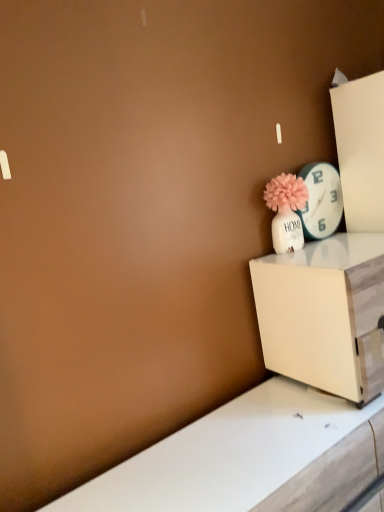
Question: Is white glossy clock at upper right to the left of matte white vase with pink flower at upper right from the viewer's perspective?

Choices:
 (A) yes
 (B) no

Answer: (B)

Question: Does white glossy clock at upper right have a greater width compared to matte white vase with pink flower at upper right?

Choices:
 (A) no
 (B) yes

Answer: (A)

Question: Considering the relative sizes of white glossy clock at upper right and matte white vase with pink flower at upper right in the image provided, is white glossy clock at upper right smaller than matte white vase with pink flower at upper right?

Choices:
 (A) yes
 (B) no

Answer: (A)

Question: Does white glossy clock at upper right have a lesser width compared to matte white vase with pink flower at upper right?

Choices:
 (A) yes
 (B) no

Answer: (A)

Question: From the image's perspective, is white glossy clock at upper right located beneath matte white vase with pink flower at upper right?

Choices:
 (A) no
 (B) yes

Answer: (A)

Question: Considering their positions, is white glossy clock at upper right located in front of or behind matte white vase with pink flower at upper right?

Choices:
 (A) behind
 (B) front

Answer: (A)

Question: In terms of width, does white glossy clock at upper right look wider or thinner when compared to matte white vase with pink flower at upper right?

Choices:
 (A) thin
 (B) wide

Answer: (A)

Question: Considering the positions of white glossy clock at upper right and matte white vase with pink flower at upper right in the image, is white glossy clock at upper right taller or shorter than matte white vase with pink flower at upper right?

Choices:
 (A) tall
 (B) short

Answer: (A)

Question: From a real-world perspective, is white glossy clock at upper right above or below matte white vase with pink flower at upper right?

Choices:
 (A) below
 (B) above

Answer: (B)

Question: Choose the correct answer: Is matte white vase with pink flower at upper right inside white glossy clock at upper right or outside it?

Choices:
 (A) outside
 (B) inside

Answer: (A)

Question: In terms of size, does matte white vase with pink flower at upper right appear bigger or smaller than white glossy clock at upper right?

Choices:
 (A) small
 (B) big

Answer: (B)

Question: Is matte white vase with pink flower at upper right wider or thinner than white glossy clock at upper right?

Choices:
 (A) wide
 (B) thin

Answer: (A)

Question: In terms of height, does matte white vase with pink flower at upper right look taller or shorter compared to white glossy clock at upper right?

Choices:
 (A) tall
 (B) short

Answer: (B)

Question: Does point click(x=294, y=197) appear closer or farther from the camera than point click(x=352, y=252)?

Choices:
 (A) closer
 (B) farther

Answer: (B)

Question: Considering the positions of matte white vase with pink flower at upper right and white wood nightstand at lower right in the image, is matte white vase with pink flower at upper right wider or thinner than white wood nightstand at lower right?

Choices:
 (A) wide
 (B) thin

Answer: (B)